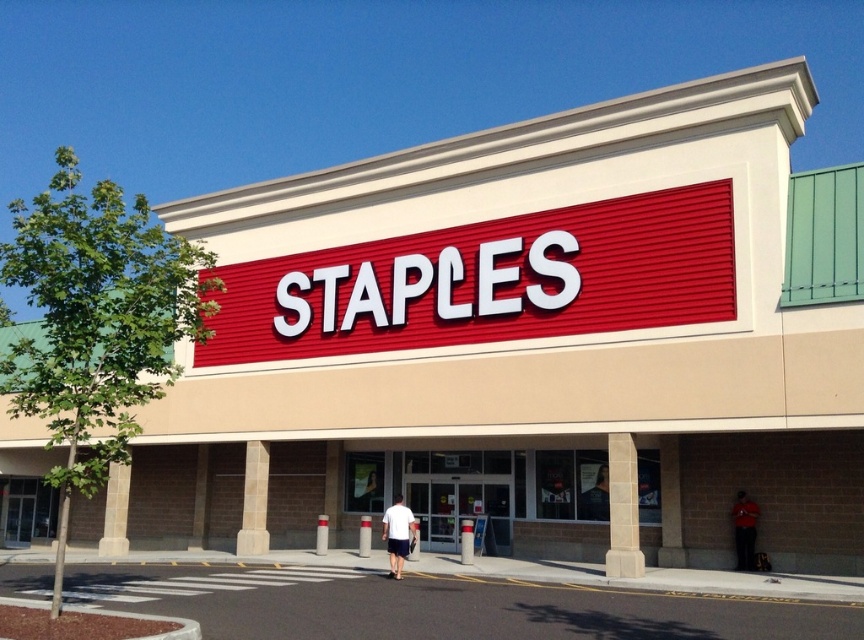
You are standing at the entrance of the Staples store and want to determine the relative positions of two points marked on the facade. Which point, point 1 at coordinates [391,515] or point 2 at coordinates [595,492], is closer to you?

Point 1 at coordinates [391,515] is closer to the viewer than point 2 at coordinates [595,492].

You are a fashion designer observing two shirts in the image. The white matte shirt at center and the smooth black shirt at lower center. Which shirt is positioned higher in the image?

The white matte shirt at center is positioned higher than the smooth black shirt at lower center.